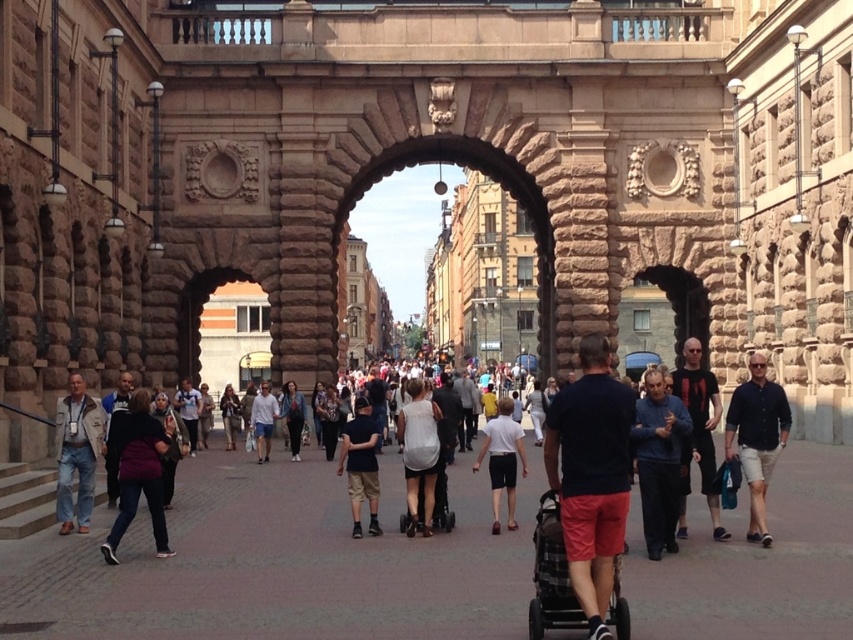
Looking at this image, is dark purple sweater at center thinner than dark blue t-shirt at center?

No.

Based on the photo, does dark purple sweater at center appear under dark blue t-shirt at center?

No.

Between point (136, 397) and point (368, 435), which one is positioned in front?

Point (136, 397)

Find the location of `dark purple sweater at center`. dark purple sweater at center is located at coordinates pyautogui.click(x=138, y=474).

How far apart are khaki fabric jacket at left and dark blue shirt at center?

khaki fabric jacket at left is 23.51 meters from dark blue shirt at center.

Is khaki fabric jacket at left wider than dark blue shirt at center?

Correct, the width of khaki fabric jacket at left exceeds that of dark blue shirt at center.

The height and width of the screenshot is (640, 853). What do you see at coordinates (76, 452) in the screenshot? I see `khaki fabric jacket at left` at bounding box center [76, 452].

Image resolution: width=853 pixels, height=640 pixels. What are the coordinates of `khaki fabric jacket at left` in the screenshot? It's located at (76, 452).

Can you confirm if khaki fabric jacket at left is positioned above light brown leather jacket at center?

Indeed, khaki fabric jacket at left is positioned over light brown leather jacket at center.

At what (x,y) coordinates should I click in order to perform the action: click on khaki fabric jacket at left. Please return your answer as a coordinate pair (x, y). The width and height of the screenshot is (853, 640). Looking at the image, I should click on (76, 452).

The height and width of the screenshot is (640, 853). I want to click on khaki fabric jacket at left, so click(76, 452).